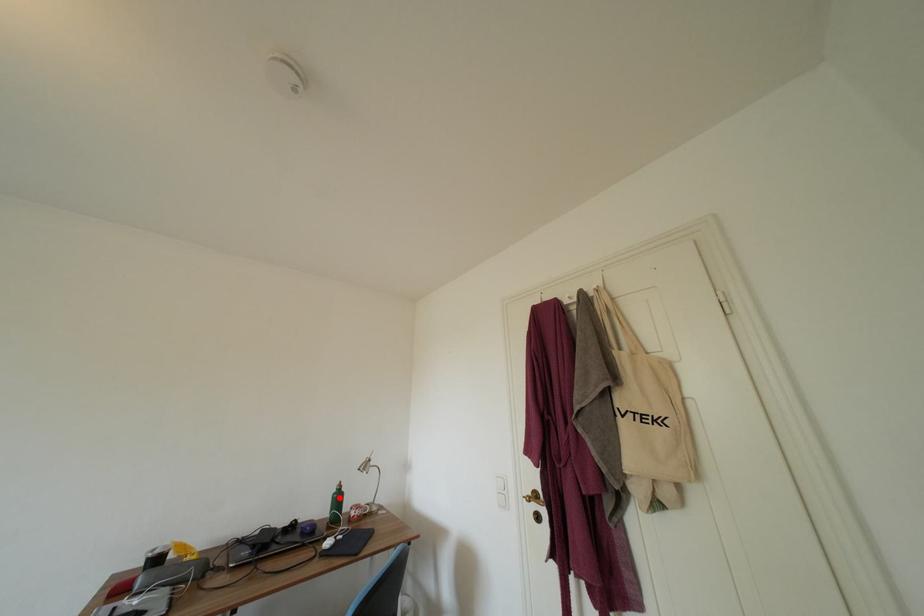
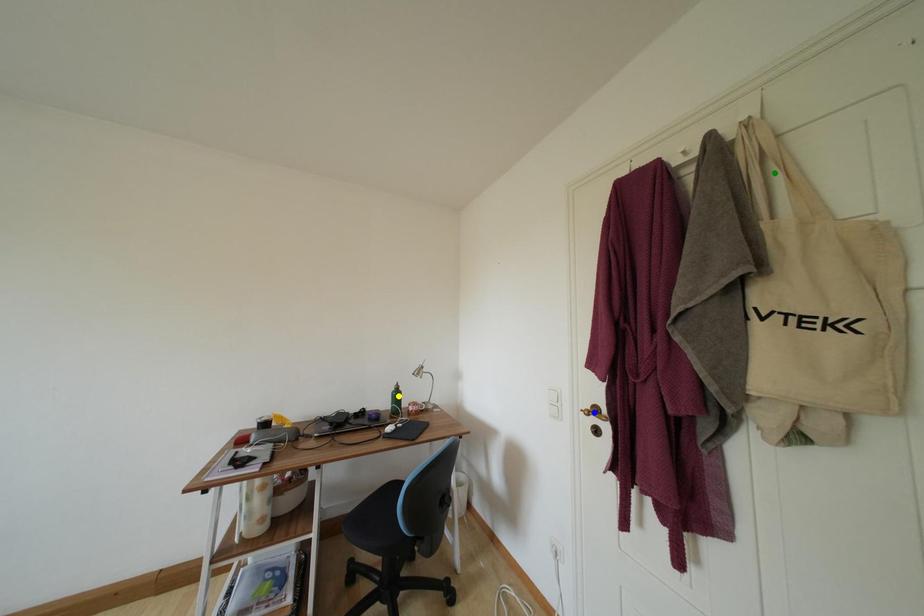
Question: I am providing you with two images of the same scene from different viewpoints. A red point is marked on the first image. You are given multiple points on the second image. Which point in image 2 is actually the same real-world point as the red point in image 1?

Choices:
 (A) yellow point
 (B) green point
 (C) blue point

Answer: (A)